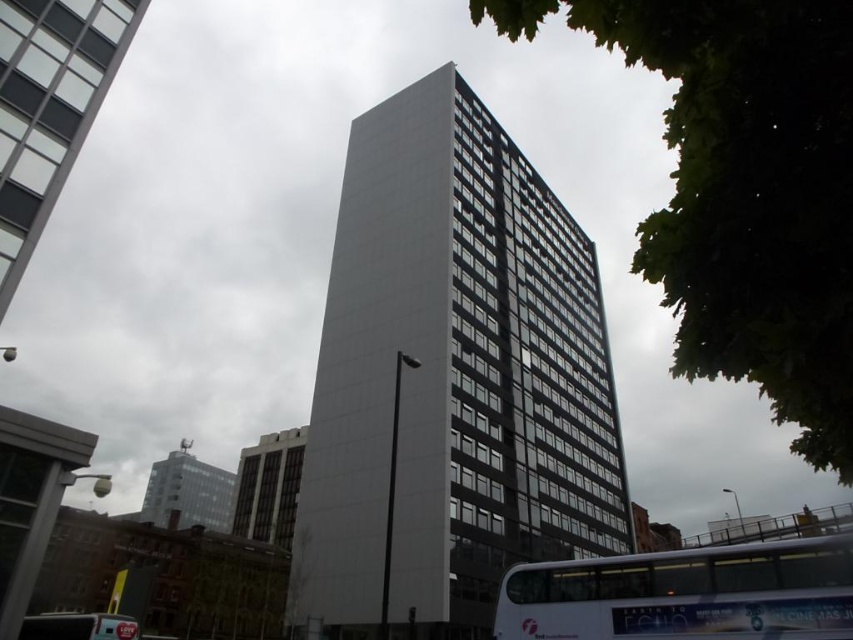
Does white glass building at center have a smaller size compared to white plastic bus at lower left?

No.

Does point (317, 499) lie behind point (45, 621)?

Yes.

Find the location of `white glass building at center`. white glass building at center is located at coordinates [453, 376].

Where is `white glass building at center`? The height and width of the screenshot is (640, 853). white glass building at center is located at coordinates (453, 376).

Which is below, white glass double-decker bus at lower center or white glass building at upper left?

white glass double-decker bus at lower center is lower down.

Between point (741, 616) and point (3, 276), which one is positioned in front?

Point (741, 616)

I want to click on white glass double-decker bus at lower center, so click(x=685, y=593).

Is white glass double-decker bus at lower center below white plastic bus at lower left?

Actually, white glass double-decker bus at lower center is above white plastic bus at lower left.

Is white glass double-decker bus at lower center thinner than white plastic bus at lower left?

Yes.

Who is more distant from viewer, (712, 618) or (73, 636)?

The point (73, 636) is behind.

Find the location of a particular element. This screenshot has height=640, width=853. white glass double-decker bus at lower center is located at coordinates (685, 593).